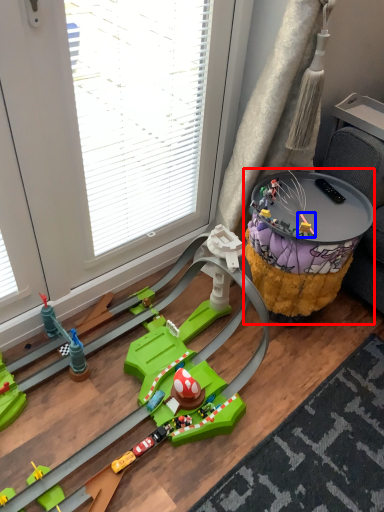
Question: Which object is closer to the camera taking this photo, table (highlighted by a red box) or toy (highlighted by a blue box)?

Choices:
 (A) table
 (B) toy

Answer: (A)